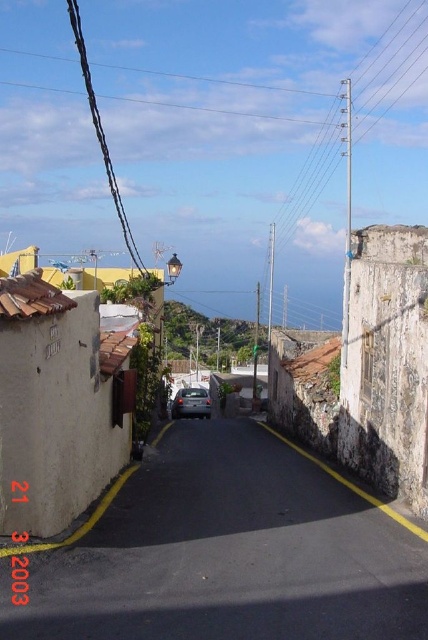
Question: Which point is farther from the camera taking this photo?

Choices:
 (A) (178, 413)
 (B) (394, 625)

Answer: (A)

Question: In this image, where is black asphalt road at center located relative to satin black car at center?

Choices:
 (A) above
 (B) below

Answer: (A)

Question: Which of the following is the closest to the observer?

Choices:
 (A) (86, 586)
 (B) (366, 419)

Answer: (A)

Question: Among these objects, which one is nearest to the camera?

Choices:
 (A) stucco wall at right
 (B) black asphalt road at center

Answer: (B)

Question: Is black asphalt road at center below stucco wall at right?

Choices:
 (A) no
 (B) yes

Answer: (B)

Question: Where is stucco wall at right located in relation to satin black car at center in the image?

Choices:
 (A) left
 (B) right

Answer: (B)